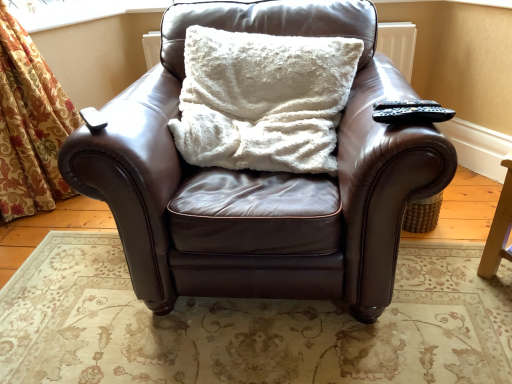
Question: From the image's perspective, is black plastic remote at upper right on top of brown leather chair at center?

Choices:
 (A) yes
 (B) no

Answer: (A)

Question: Considering the relative positions of black plastic remote at upper right and brown leather chair at center in the image provided, is black plastic remote at upper right to the left of brown leather chair at center from the viewer's perspective?

Choices:
 (A) yes
 (B) no

Answer: (B)

Question: Could you tell me if black plastic remote at upper right is turned towards brown leather chair at center?

Choices:
 (A) no
 (B) yes

Answer: (B)

Question: Is black plastic remote at upper right wider than brown leather chair at center?

Choices:
 (A) yes
 (B) no

Answer: (B)

Question: Does black plastic remote at upper right have a larger size compared to brown leather chair at center?

Choices:
 (A) no
 (B) yes

Answer: (A)

Question: Is black plastic remote at upper right to the right of brown leather chair at center from the viewer's perspective?

Choices:
 (A) yes
 (B) no

Answer: (A)

Question: Could you tell me if black plastic remote at upper right is turned towards white fluffy pillow at center?

Choices:
 (A) yes
 (B) no

Answer: (B)

Question: Is black plastic remote at upper right wider than white fluffy pillow at center?

Choices:
 (A) no
 (B) yes

Answer: (A)

Question: From a real-world perspective, is black plastic remote at upper right on top of white fluffy pillow at center?

Choices:
 (A) yes
 (B) no

Answer: (A)

Question: Does black plastic remote at upper right contain white fluffy pillow at center?

Choices:
 (A) no
 (B) yes

Answer: (A)

Question: Is white fluffy pillow at center at the back of black plastic remote at upper right?

Choices:
 (A) yes
 (B) no

Answer: (B)

Question: Considering the relative sizes of black plastic remote at upper right and white fluffy pillow at center in the image provided, is black plastic remote at upper right smaller than white fluffy pillow at center?

Choices:
 (A) yes
 (B) no

Answer: (A)

Question: From the image's perspective, does transparent plastic window screen at upper left appear higher than white fluffy pillow at center?

Choices:
 (A) yes
 (B) no

Answer: (A)